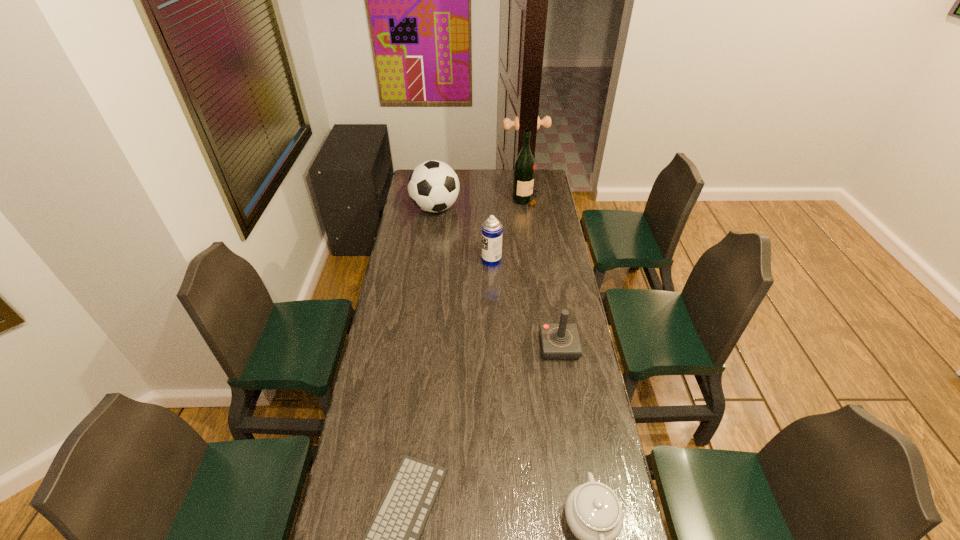
I want to click on wine bottle, so click(x=524, y=169).

What are the coordinates of `soccer ball` in the screenshot? It's located at (433, 186).

Locate an element on the screen. Image resolution: width=960 pixels, height=540 pixels. aerosol can is located at coordinates (492, 228).

Identify the location of the fourth object from right to left. This screenshot has height=540, width=960. (492, 228).

At what (x,y) coordinates should I click in order to perform the action: click on joystick. Please return your answer as a coordinate pair (x, y). This screenshot has height=540, width=960. Looking at the image, I should click on (560, 341).

What are the coordinates of `the third nearest object` in the screenshot? It's located at (560, 341).

Locate an element on the screen. vacant space located 0.370m on the front of the tallest object is located at coordinates (534, 252).

The height and width of the screenshot is (540, 960). I want to click on free region located 0.370m on the front of the soccer ball, so click(x=427, y=271).

Find the location of a particular element. This screenshot has height=540, width=960. vacant region located 0.110m on the label side of the aerosol can is located at coordinates (458, 260).

You are a GUI agent. You are given a task and a screenshot of the screen. Output one action in this format:
    pyautogui.click(x=<x>, y=<y>)
    Task: Click on the free region located on the label side of the aerosol can
    Image resolution: width=960 pixels, height=540 pixels.
    Given the screenshot: What is the action you would take?
    pyautogui.click(x=444, y=260)